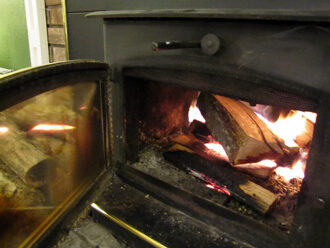
Locate an element on the screen. glass is located at coordinates (40, 139).